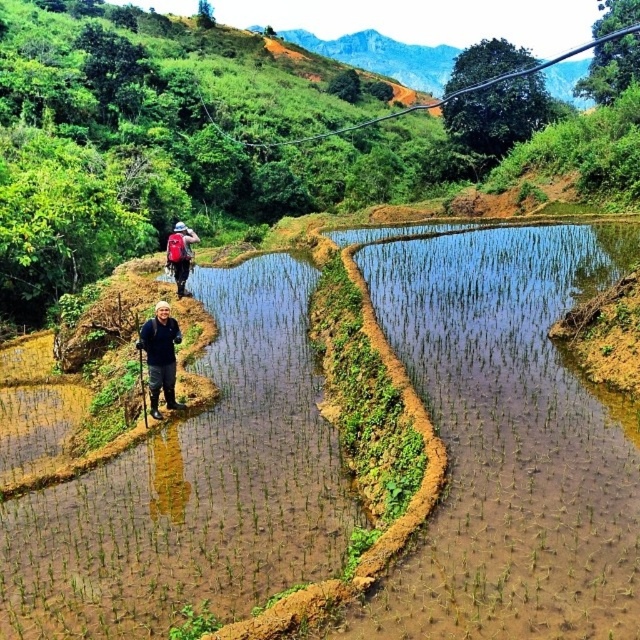
Is point (572, 465) in front of point (164, 388)?

Yes, it is in front of point (164, 388).

The width and height of the screenshot is (640, 640). What are the coordinates of `brown soil at center` in the screenshot? It's located at (509, 442).

Can you confirm if brown soil at center is shorter than matte red backpack at center?

No.

Is point (618, 468) closer to viewer compared to point (182, 273)?

Yes, point (618, 468) is in front of point (182, 273).

This screenshot has width=640, height=640. In order to click on brown soil at center in this screenshot , I will do `click(509, 442)`.

Does point (144, 340) come closer to viewer compared to point (182, 259)?

Yes, point (144, 340) is in front of point (182, 259).

Does dark blue jeans at center have a larger size compared to matte red backpack at center?

Actually, dark blue jeans at center might be smaller than matte red backpack at center.

Who is more forward, (164, 330) or (179, 244)?

Point (164, 330) is in front.

Where is `dark blue jeans at center`? This screenshot has height=640, width=640. dark blue jeans at center is located at coordinates (161, 356).